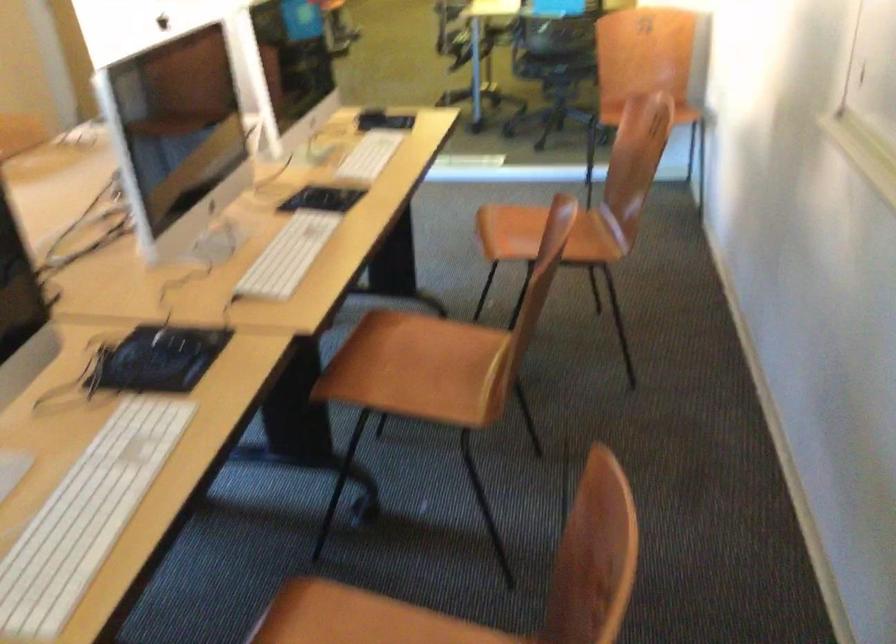
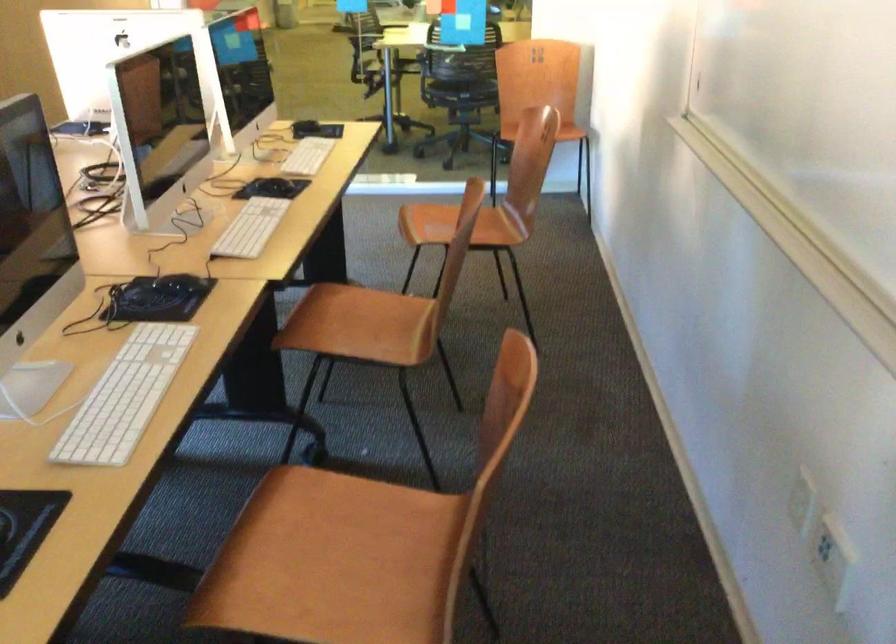
Question: The images are taken continuously from a first-person perspective. In which direction is your viewpoint rotating?

Choices:
 (A) Left
 (B) Right
 (C) Up
 (D) Down

Answer: (B)